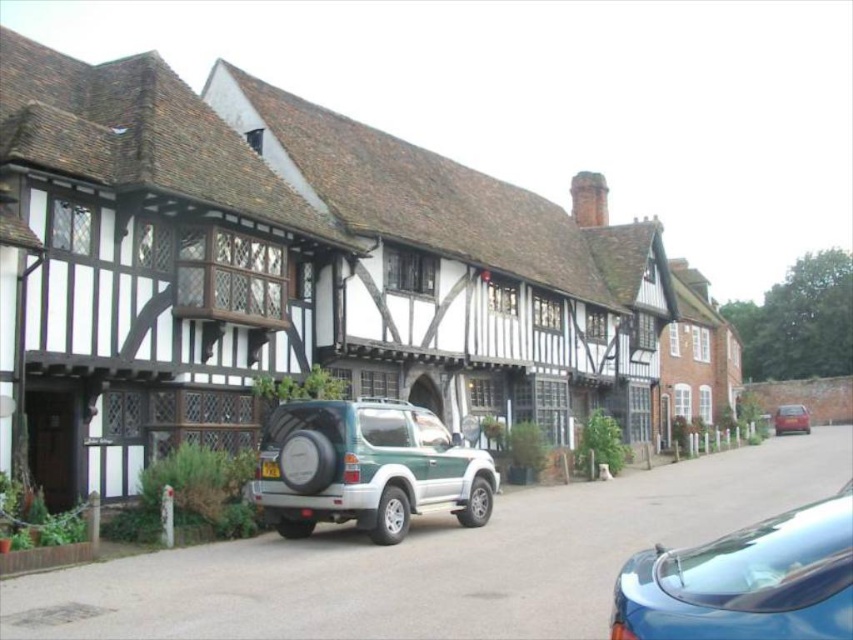
Does glossy blue car at lower right have a greater height compared to matte red car at center?

Indeed, glossy blue car at lower right has a greater height compared to matte red car at center.

Is glossy blue car at lower right wider than matte red car at center?

No.

Between point (762, 547) and point (807, 412), which one is positioned in front?

Point (762, 547) is in front.

You are a GUI agent. You are given a task and a screenshot of the screen. Output one action in this format:
    pyautogui.click(x=<x>, y=<y>)
    Task: Click on the glossy blue car at lower right
    The width and height of the screenshot is (853, 640).
    Given the screenshot: What is the action you would take?
    pyautogui.click(x=746, y=580)

The height and width of the screenshot is (640, 853). Describe the element at coordinates (367, 467) in the screenshot. I see `green matte suv at center` at that location.

Find the location of `green matte suv at center`. green matte suv at center is located at coordinates (x=367, y=467).

I want to click on green matte suv at center, so click(x=367, y=467).

Is glossy blue car at lower right to the left of black plastic license plate at center from the viewer's perspective?

No, glossy blue car at lower right is not to the left of black plastic license plate at center.

Which of these two, glossy blue car at lower right or black plastic license plate at center, stands shorter?

black plastic license plate at center is shorter.

This screenshot has height=640, width=853. I want to click on glossy blue car at lower right, so click(746, 580).